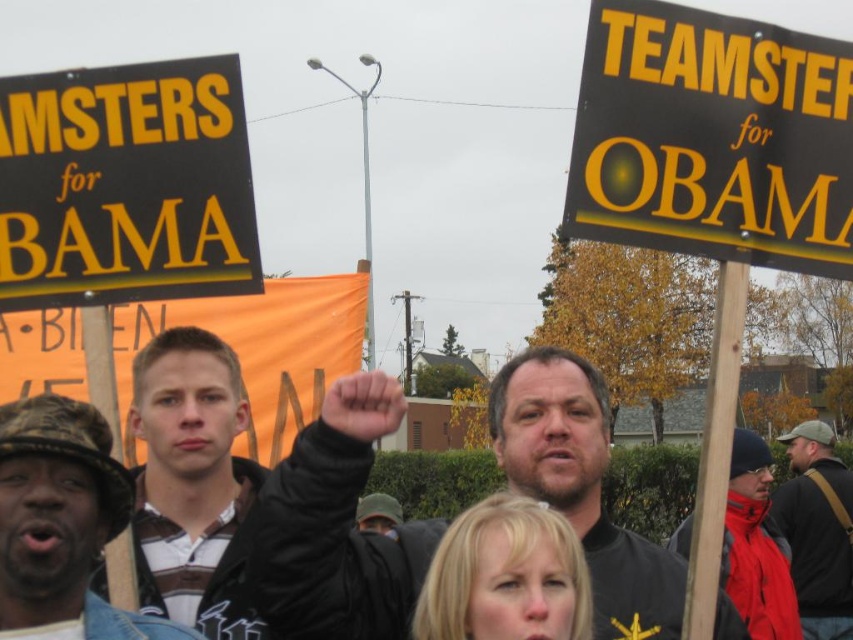
Question: Can you confirm if black/yellow/black sign at upper right is wider than dark brown leather jacket at center?

Choices:
 (A) no
 (B) yes

Answer: (B)

Question: Which point appears closest to the camera in this image?

Choices:
 (A) (791, 628)
 (B) (218, 444)

Answer: (B)

Question: Which object is closer to the camera taking this photo?

Choices:
 (A) black matte jacket at center
 (B) dark brown leather jacket at center
 (C) black/yellow/black sign at left

Answer: (C)

Question: Is black matte jacket at center bigger than brown camo hat at left?

Choices:
 (A) yes
 (B) no

Answer: (A)

Question: Which point is farther to the camera?

Choices:
 (A) black matte jacket at center
 (B) red fleece jacket at lower right
 (C) matte black jacket at center

Answer: (C)

Question: Is black/yellow/black sign at left below matte black jacket at center?

Choices:
 (A) yes
 (B) no

Answer: (B)